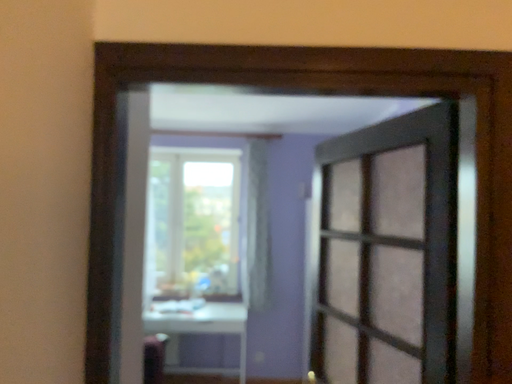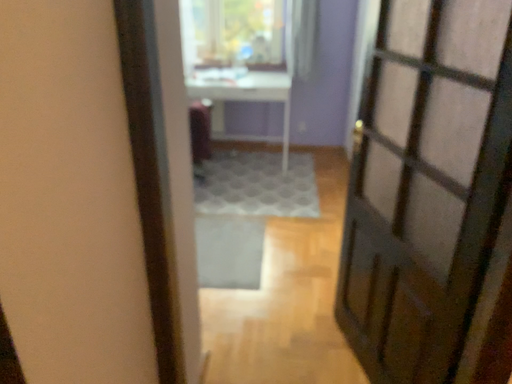
Question: Which way did the camera rotate in the video?

Choices:
 (A) rotated upward
 (B) rotated downward

Answer: (B)